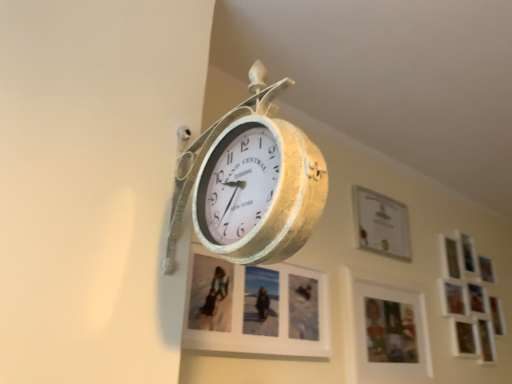
Question: Is matte white picture frame at center, the fourth picture frame viewed from the right, inside the boundaries of wooden photo frame at lower right, which is the 2th picture frame from left to right, or outside?

Choices:
 (A) outside
 (B) inside

Answer: (A)

Question: Is matte white picture frame at center, the 1th picture frame viewed from the left, bigger or smaller than wooden photo frame at lower right, which is the 2th picture frame from left to right?

Choices:
 (A) big
 (B) small

Answer: (B)

Question: Estimate the real-world distances between objects in this image. Which object is farther from the gold textured clock at center?

Choices:
 (A) white matte picture frame at upper right, the first picture frame when ordered from right to left
 (B) wooden photo frame at lower right, which is the 2th picture frame from left to right
 (C) matte white picture frame at center, the fourth picture frame viewed from the right
 (D) matte white picture frame at upper center, which ranks as the 3th picture frame in left-to-right order

Answer: (A)

Question: Estimate the real-world distances between objects in this image. Which object is farther from the wooden photo frame at lower right, which is the 2th picture frame from left to right?

Choices:
 (A) matte white picture frame at center, the fourth picture frame viewed from the right
 (B) matte white picture frame at upper center, which ranks as the 3th picture frame in left-to-right order
 (C) white matte picture frame at upper right, the first picture frame when ordered from right to left
 (D) gold textured clock at center

Answer: (D)